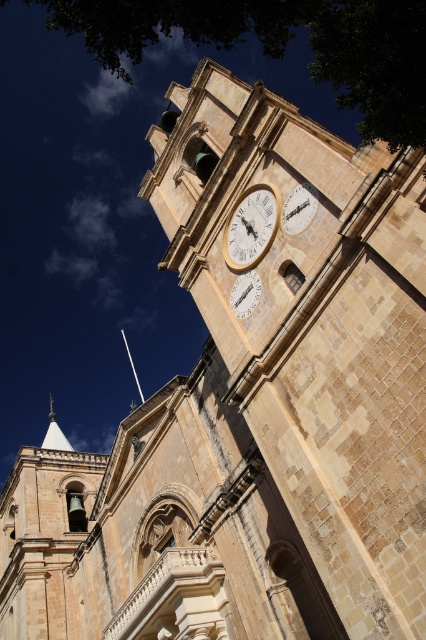
Between white stone spire at upper left and silver metallic spire at upper left, which one appears on the left side from the viewer's perspective?

From the viewer's perspective, white stone spire at upper left appears more on the left side.

Is white stone spire at upper left below silver metallic spire at upper left?

Correct, white stone spire at upper left is located below silver metallic spire at upper left.

Is point (45, 436) behind point (137, 381)?

That is True.

This screenshot has width=426, height=640. Find the location of `white stone spire at upper left`. white stone spire at upper left is located at coordinates (54, 433).

Between white glossy clock at center and silver metallic spire at upper left, which one appears on the left side from the viewer's perspective?

From the viewer's perspective, silver metallic spire at upper left appears more on the left side.

Can you confirm if white glossy clock at center is bigger than silver metallic spire at upper left?

No, white glossy clock at center is not bigger than silver metallic spire at upper left.

The image size is (426, 640). Identify the location of white glossy clock at center. (244, 292).

Is white glossy clock at center positioned in front of white stone spire at upper left?

Yes, it is in front of white stone spire at upper left.

Can you confirm if white glossy clock at center is thinner than white stone spire at upper left?

Correct, white glossy clock at center's width is less than white stone spire at upper left's.

Which is in front, point (250, 304) or point (66, 449)?

Point (250, 304) is more forward.

What are the coordinates of `white glossy clock at center` in the screenshot? It's located at (244, 292).